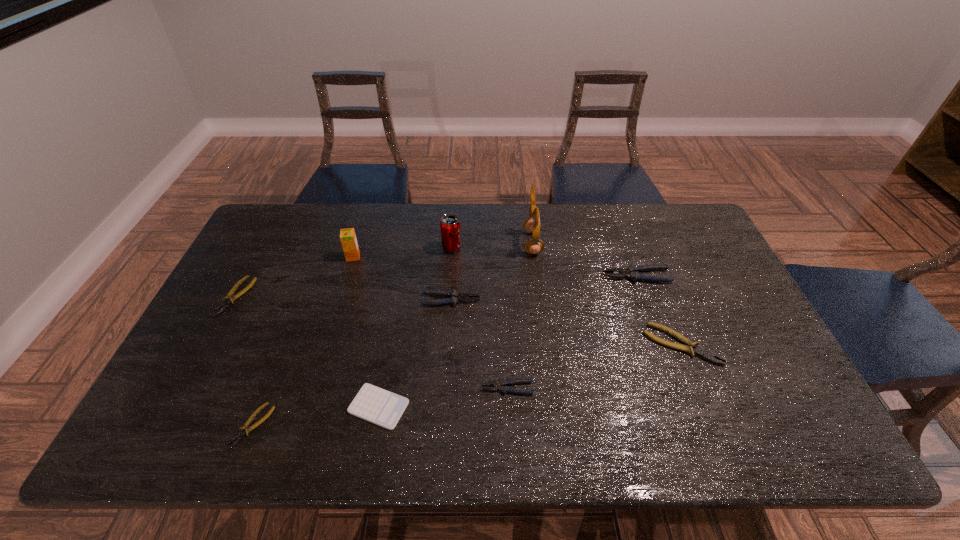
Identify the location of earphone. (532, 225).

This screenshot has width=960, height=540. I want to click on the third object from right to left, so click(x=532, y=225).

Where is `red soda can`? This screenshot has height=540, width=960. red soda can is located at coordinates (450, 225).

The image size is (960, 540). Find the location of `orange juice`. orange juice is located at coordinates [x=348, y=239].

Where is `the tallest pliers`? This screenshot has width=960, height=540. the tallest pliers is located at coordinates (632, 272).

At what (x,y) coordinates should I click in order to perform the action: click on the biggest gray pliers. Please return your answer as a coordinate pair (x, y). Looking at the image, I should click on (632, 272).

Identify the location of the second biggest gray pliers. (454, 297).

The height and width of the screenshot is (540, 960). Find the location of `the second tallest pliers`. the second tallest pliers is located at coordinates (454, 297).

You are a GUI agent. You are given a task and a screenshot of the screen. Output one action in this format:
    pyautogui.click(x=<x>, y=<y>)
    Task: Click on the rightmost yellow pliers
    The width and height of the screenshot is (960, 540).
    Given the screenshot: What is the action you would take?
    pyautogui.click(x=706, y=354)

At what (x,y) coordinates should I click in order to perform the action: click on the biggest yellow pliers. Please return your answer as a coordinate pair (x, y). Looking at the image, I should click on (706, 354).